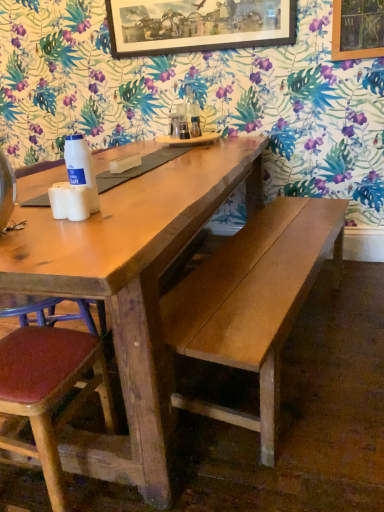
Question: Does wooden framed artwork at upper center have a greater height compared to wooden tray at center?

Choices:
 (A) yes
 (B) no

Answer: (A)

Question: Is wooden framed artwork at upper center further to the viewer compared to wooden tray at center?

Choices:
 (A) yes
 (B) no

Answer: (B)

Question: From a real-world perspective, is wooden framed artwork at upper center on top of wooden tray at center?

Choices:
 (A) yes
 (B) no

Answer: (A)

Question: Considering the relative sizes of wooden framed artwork at upper center and wooden tray at center in the image provided, is wooden framed artwork at upper center wider than wooden tray at center?

Choices:
 (A) yes
 (B) no

Answer: (B)

Question: From a real-world perspective, is wooden framed artwork at upper center beneath wooden tray at center?

Choices:
 (A) no
 (B) yes

Answer: (A)

Question: From the image's perspective, is wooden framed artwork at upper center below wooden tray at center?

Choices:
 (A) yes
 (B) no

Answer: (B)

Question: Is there a large distance between brown wood chair at lower left and wooden tray at center?

Choices:
 (A) no
 (B) yes

Answer: (B)

Question: Are brown wood chair at lower left and wooden tray at center making contact?

Choices:
 (A) no
 (B) yes

Answer: (A)

Question: Can you confirm if brown wood chair at lower left is thinner than wooden tray at center?

Choices:
 (A) no
 (B) yes

Answer: (B)

Question: Could you tell me if brown wood chair at lower left is facing wooden tray at center?

Choices:
 (A) yes
 (B) no

Answer: (A)

Question: From a real-world perspective, is brown wood chair at lower left positioned under wooden tray at center based on gravity?

Choices:
 (A) yes
 (B) no

Answer: (A)

Question: Can you confirm if brown wood chair at lower left is smaller than wooden tray at center?

Choices:
 (A) yes
 (B) no

Answer: (B)

Question: Considering the relative sizes of wooden tray at center and wooden bench at center in the image provided, is wooden tray at center thinner than wooden bench at center?

Choices:
 (A) no
 (B) yes

Answer: (B)